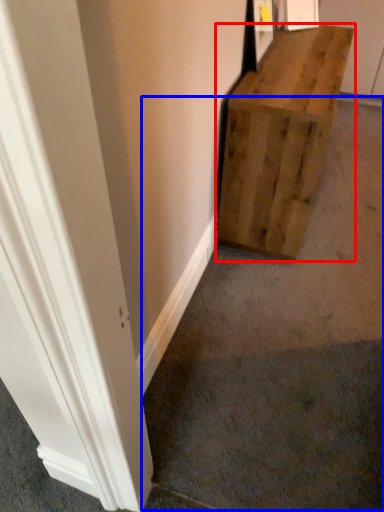
Question: Which object is further to the camera taking this photo, furniture (highlighted by a red box) or concrete (highlighted by a blue box)?

Choices:
 (A) furniture
 (B) concrete

Answer: (A)